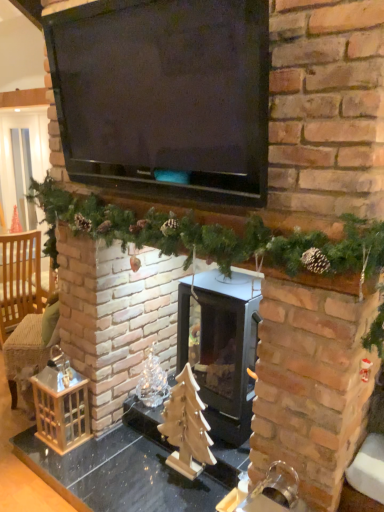
At what (x,y) coordinates should I click in order to perform the action: click on vacant space underneath wooden christmas tree at center (from a real-world perspective). Please return your answer as a coordinate pair (x, y). This screenshot has height=512, width=384. Looking at the image, I should click on (182, 471).